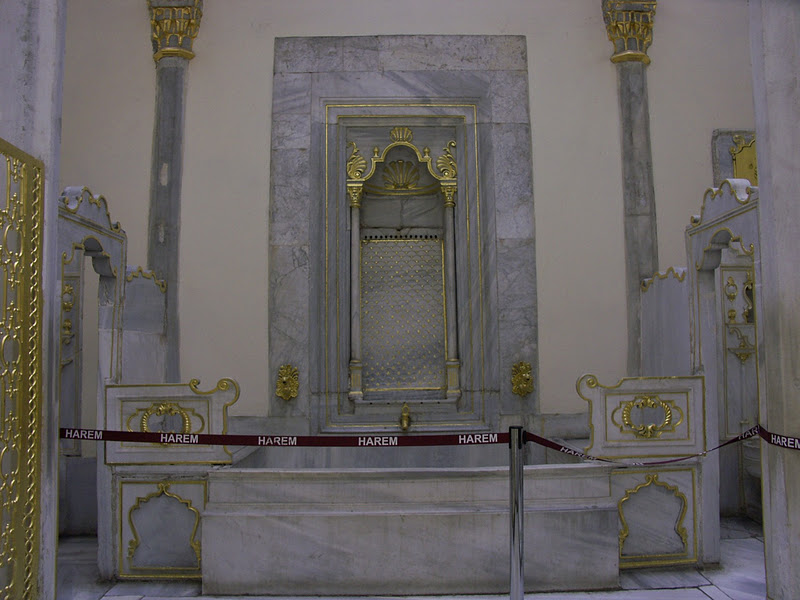
Locate an element on the screen. Image resolution: width=800 pixels, height=600 pixels. golden faucet is located at coordinates (408, 422).